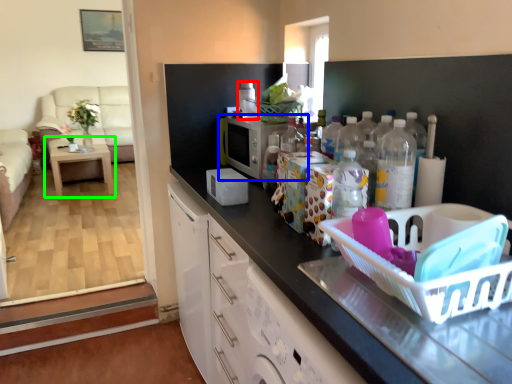
Question: Which is farther away from appliance (highlighted by a red box)? appliance (highlighted by a blue box) or table (highlighted by a green box)?

Choices:
 (A) appliance
 (B) table

Answer: (B)